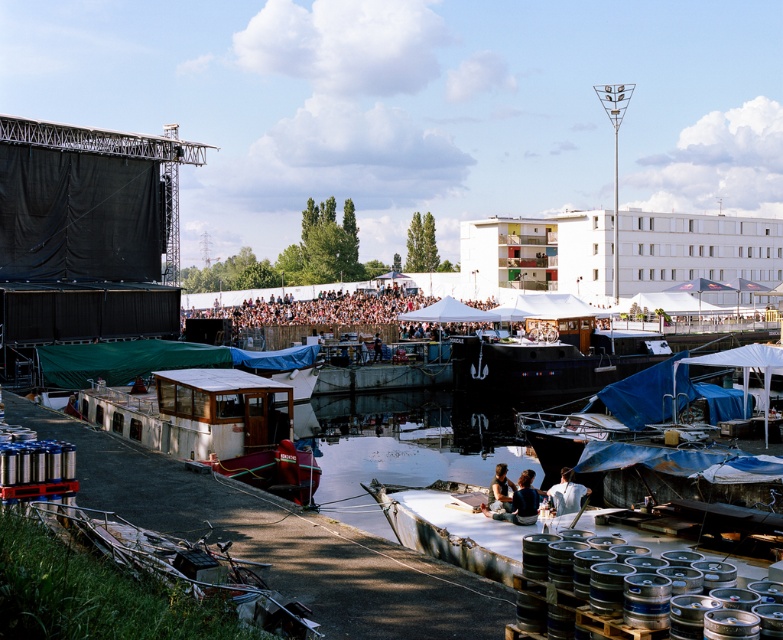
Is white wooden boat at center thinner than matte white shirt at center?

No, white wooden boat at center is not thinner than matte white shirt at center.

Who is positioned more to the left, white wooden boat at center or matte white shirt at center?

From the viewer's perspective, white wooden boat at center appears more on the left side.

Between point (242, 428) and point (531, 522), which one is positioned in front?

Point (531, 522) is more forward.

You are a GUI agent. You are given a task and a screenshot of the screen. Output one action in this format:
    pyautogui.click(x=<x>, y=<y>)
    Task: Click on the white wooden boat at center
    The image size is (783, 640).
    Given the screenshot: What is the action you would take?
    pyautogui.click(x=215, y=426)

Between point (226, 440) and point (574, 420), which one is positioned in front?

Point (226, 440) is more forward.

Does point (233, 385) lie behind point (744, 404)?

No, (233, 385) is closer to viewer.

Identify the location of white wooden boat at center. Image resolution: width=783 pixels, height=640 pixels. (215, 426).

Is white canvas boat at lower center smaller than matte blue shirt at center?

Indeed, white canvas boat at lower center has a smaller size compared to matte blue shirt at center.

Between point (456, 563) and point (502, 481), which one is positioned in front?

Point (456, 563) is more forward.

What do you see at coordinates (442, 536) in the screenshot? The height and width of the screenshot is (640, 783). I see `white canvas boat at lower center` at bounding box center [442, 536].

The image size is (783, 640). Identify the location of white canvas boat at lower center. (442, 536).